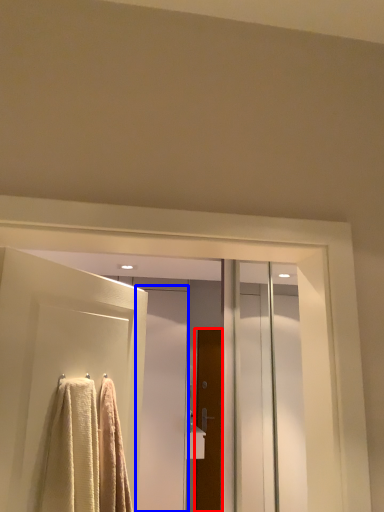
Question: Among these objects, which one is farthest to the camera, door (highlighted by a red box) or screen door (highlighted by a blue box)?

Choices:
 (A) door
 (B) screen door

Answer: (A)